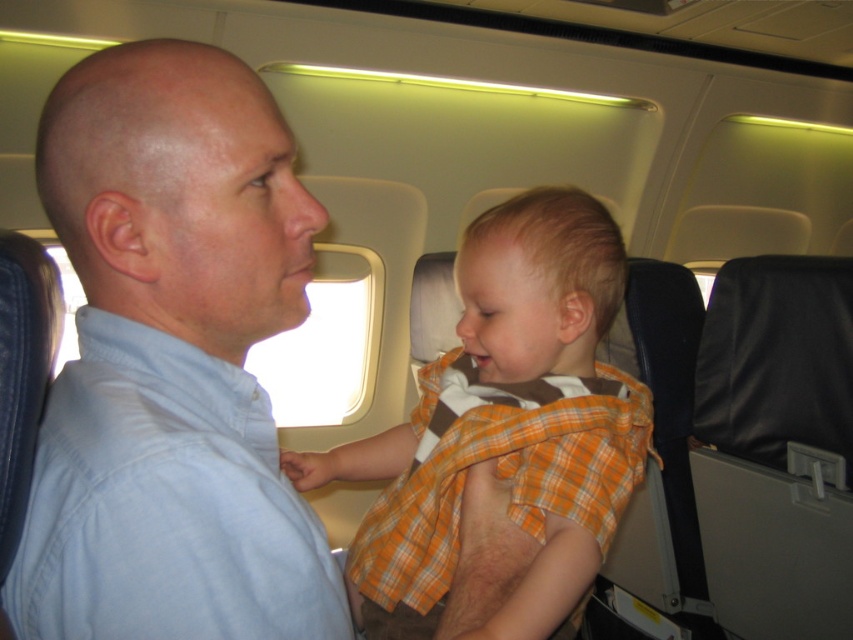
Question: Which of the following is the closest to the observer?

Choices:
 (A) light blue shirt at center
 (B) orange plaid shirt at center

Answer: (A)

Question: Is light blue shirt at center thinner than orange plaid shirt at center?

Choices:
 (A) no
 (B) yes

Answer: (B)

Question: Does light blue shirt at center have a greater width compared to orange plaid shirt at center?

Choices:
 (A) no
 (B) yes

Answer: (A)

Question: In this image, where is light blue shirt at center located relative to orange plaid shirt at center?

Choices:
 (A) below
 (B) above

Answer: (B)

Question: Among these points, which one is farthest from the camera?

Choices:
 (A) (183, 220)
 (B) (570, 218)

Answer: (B)

Question: Which of the following is the farthest from the observer?

Choices:
 (A) light blue shirt at center
 (B) orange plaid shirt at center

Answer: (B)